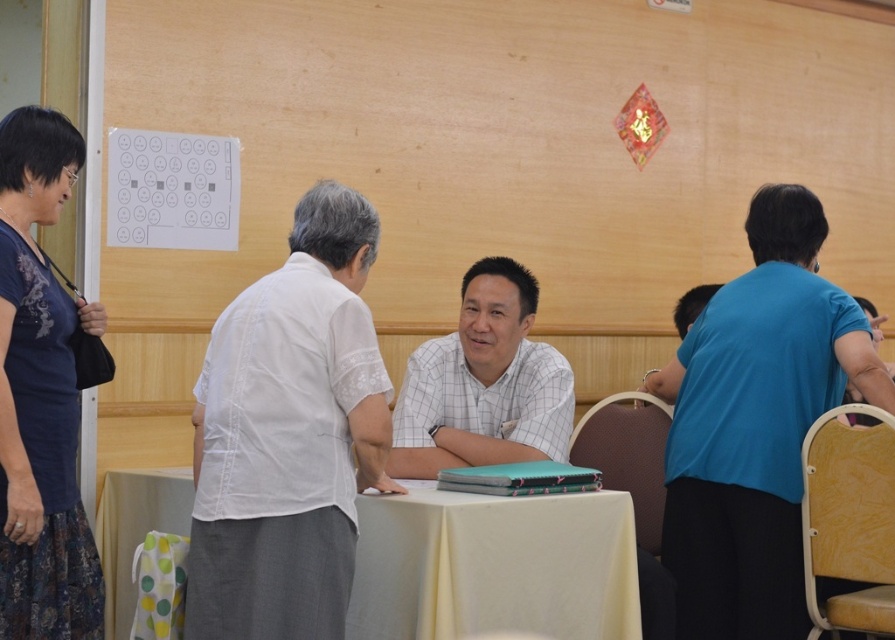
Question: Is blue fabric shirt at right to the left of dark blue fabric dress at left from the viewer's perspective?

Choices:
 (A) yes
 (B) no

Answer: (B)

Question: Estimate the real-world distances between objects in this image. Which object is closer to the white cotton shirt at center?

Choices:
 (A) blue fabric shirt at right
 (B) yellow fabric table at center

Answer: (B)

Question: Is white cotton shirt at center positioned at the back of blue fabric shirt at right?

Choices:
 (A) no
 (B) yes

Answer: (A)

Question: Does white cotton shirt at center appear under yellow fabric table at center?

Choices:
 (A) yes
 (B) no

Answer: (B)

Question: Which object appears farthest from the camera in this image?

Choices:
 (A) white checkered shirt at center
 (B) white cotton shirt at center

Answer: (A)

Question: Which point is farther to the camera?

Choices:
 (A) (23, 534)
 (B) (424, 376)

Answer: (B)